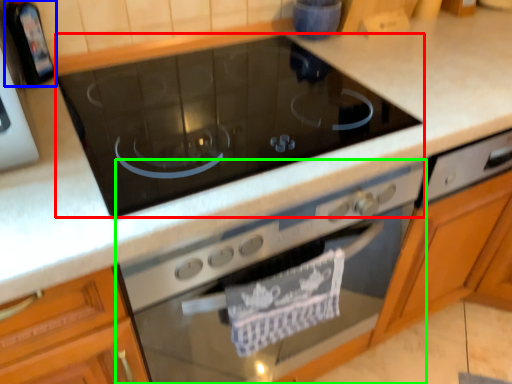
Question: Which is farther away from gas stove (highlighted by a red box)? appliance (highlighted by a blue box) or home appliance (highlighted by a green box)?

Choices:
 (A) appliance
 (B) home appliance

Answer: (A)